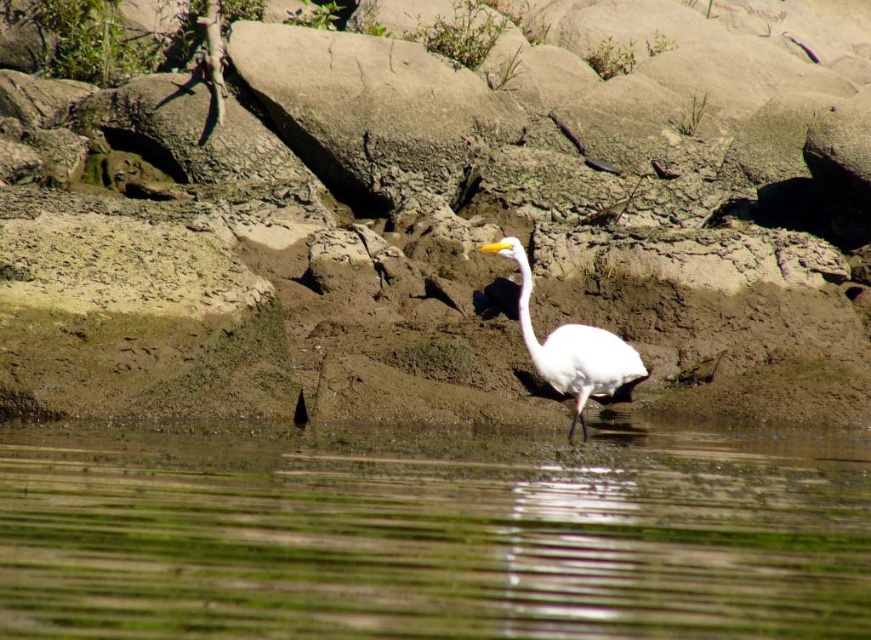
You are a photographer trying to capture the white heron in the scene. You notice two points marked in the image. The first point is at coordinates point (138, 211) and the second is at point (582, 400). Which point is closer to the camera?

Point (138, 211) is further to the camera than point (582, 400), so the second point is closer to the camera.

You are standing on the shore and notice the rough textured rock at center and the green algae water at lower center. Which object is located higher in the scene?

The rough textured rock at center is above the green algae water at lower center, so it is higher in the scene.

You are standing at the edge of the rocky shoreline and see the green algae water at lower center. Based on its coordinates, can you determine if it is positioned closer to the left or right side of the image?

The green algae water at lower center is located at point 0.838 on the x coordinate, which is closer to the right side of the image.